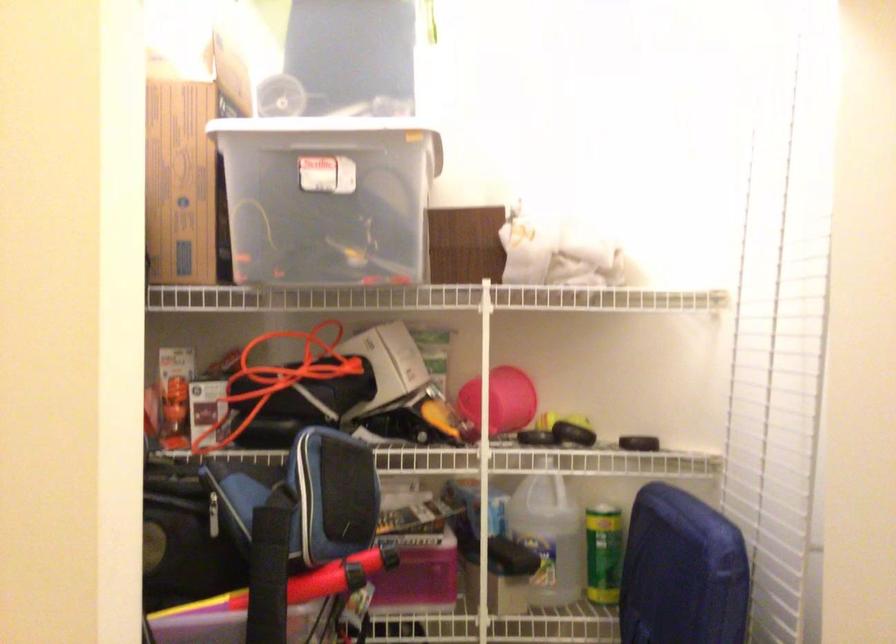
Locate an element on the screen. black fabric strap is located at coordinates (269, 574).